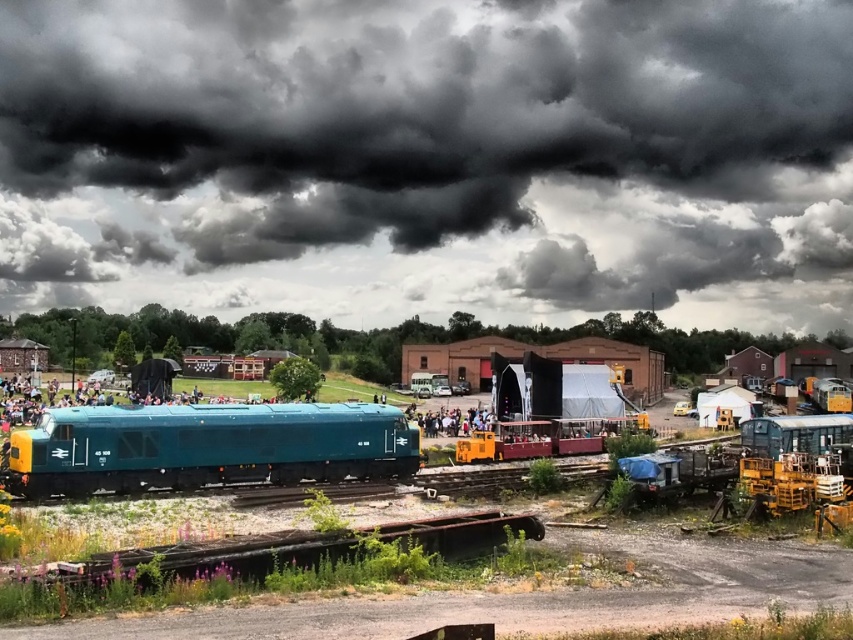
The width and height of the screenshot is (853, 640). Describe the element at coordinates (759, 445) in the screenshot. I see `green painted metal train at lower right` at that location.

Who is more forward, (834, 428) or (471, 424)?

Point (834, 428)

Does point (833, 444) come farther from viewer compared to point (428, 424)?

No, it is not.

Identify the location of green painted metal train at lower right. (759, 445).

Measure the distance from dark gray cloud at upper center to light brown wooden bench at center.

dark gray cloud at upper center and light brown wooden bench at center are 158.63 meters apart.

Identify the location of dark gray cloud at upper center. (428, 156).

The height and width of the screenshot is (640, 853). Describe the element at coordinates (428, 156) in the screenshot. I see `dark gray cloud at upper center` at that location.

Where is `dark gray cloud at upper center`? The height and width of the screenshot is (640, 853). dark gray cloud at upper center is located at coordinates (428, 156).

Is teal glossy locomotive at center to the right of green painted metal train at lower right from the viewer's perspective?

No, teal glossy locomotive at center is not to the right of green painted metal train at lower right.

Find the location of a particular element. The image size is (853, 640). teal glossy locomotive at center is located at coordinates (207, 445).

Is point (395, 428) behind point (691, 472)?

Yes, point (395, 428) is farther from viewer.

In order to click on teal glossy locomotive at center in this screenshot , I will do `click(207, 445)`.